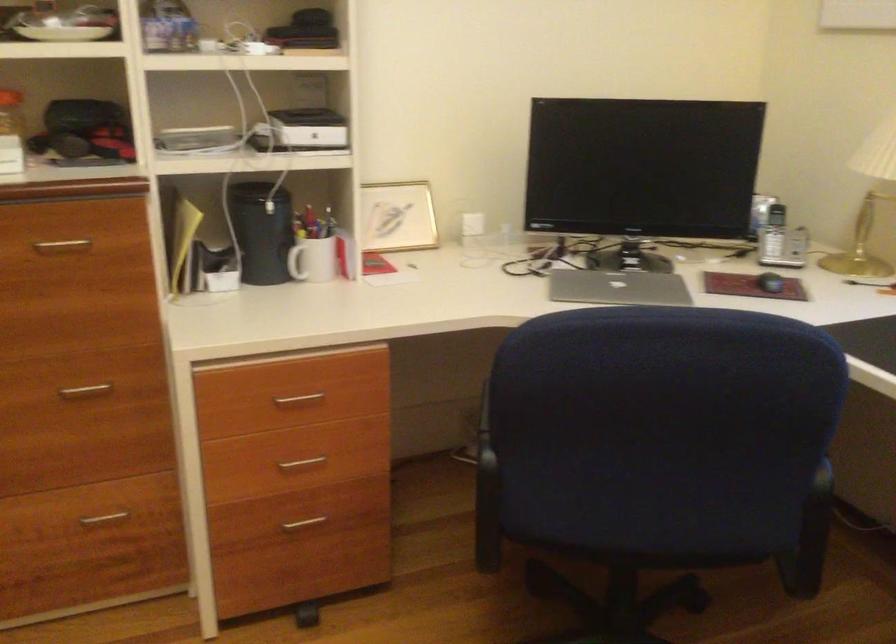
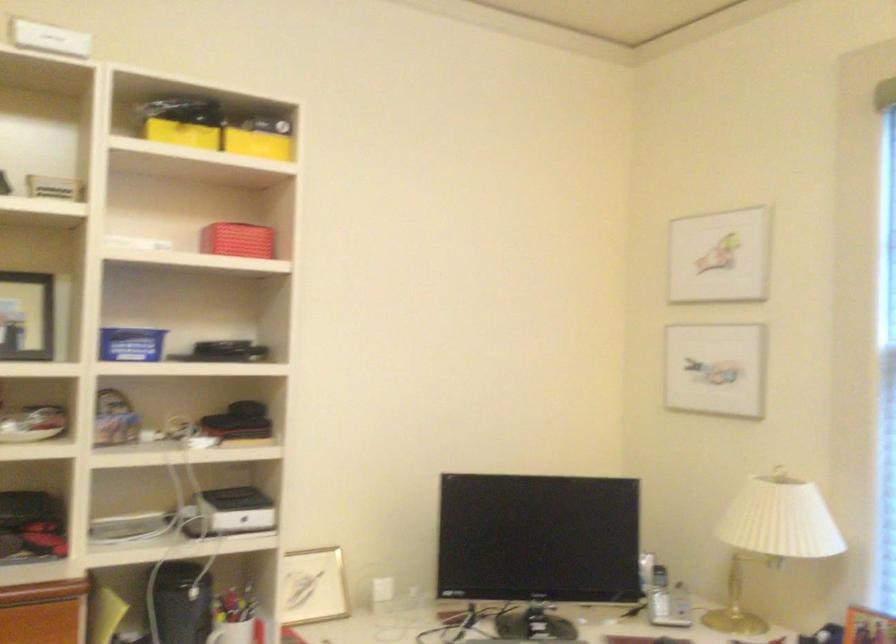
Which direction would the cameraman need to move to produce the second image?

The cameraman walked toward left, backward.